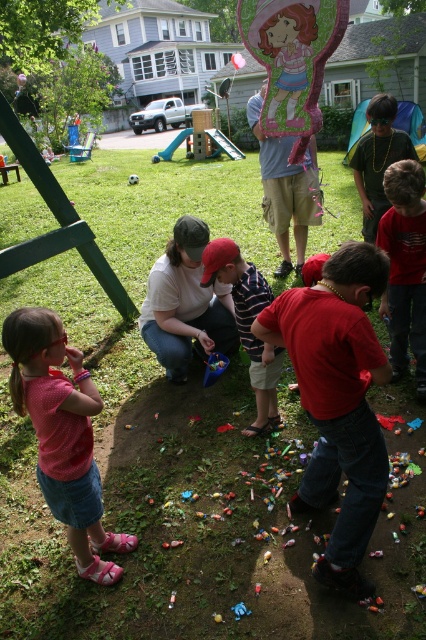
Question: Which is nearer to the matte red shirt at center?

Choices:
 (A) matte white shirt at center
 (B) matte gray shirt at center
 (C) striped cotton shirt at center

Answer: (C)

Question: From the image, what is the correct spatial relationship of matte gray shirt at center in relation to green matte pinata at center?

Choices:
 (A) right
 (B) left

Answer: (A)

Question: Which is nearer to the green matte pinata at center?

Choices:
 (A) matte red shirt at center
 (B) pink fabric dress at lower left
 (C) matte gray shirt at center

Answer: (C)

Question: Which point is farther to the camera?

Choices:
 (A) matte red shirt at center
 (B) striped cotton shirt at center

Answer: (A)

Question: Does matte white shirt at center come in front of green matte pinata at center?

Choices:
 (A) no
 (B) yes

Answer: (B)

Question: Does matte white shirt at center have a lesser width compared to striped cotton shirt at center?

Choices:
 (A) no
 (B) yes

Answer: (A)